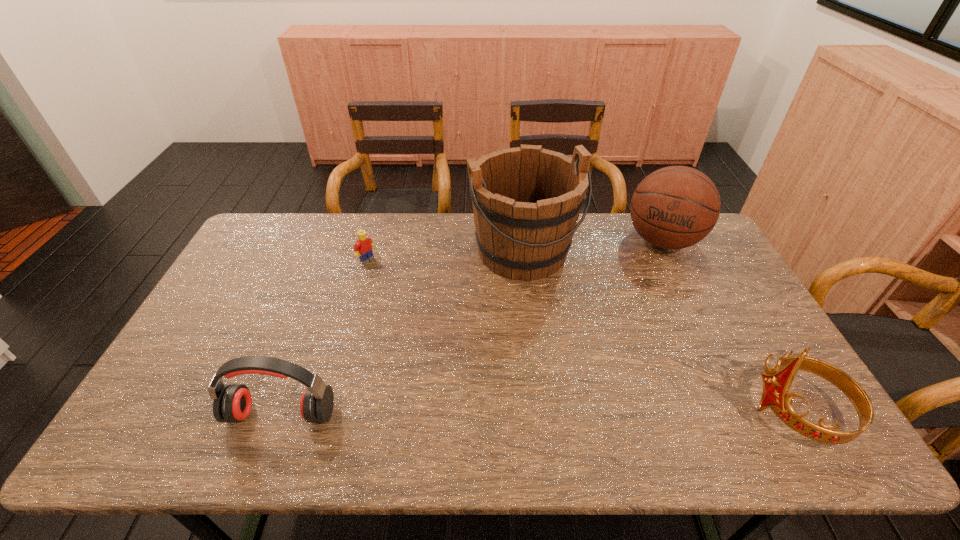
This screenshot has width=960, height=540. In order to click on vacant space situated on the front-facing side of the Lego in this screenshot , I will do `click(446, 318)`.

I want to click on vacant region located 0.390m on the front-facing side of the Lego, so tap(456, 325).

The image size is (960, 540). In order to click on vacant region located 0.310m on the side of the third object from right to left with the handle for carrying in this screenshot , I will do `click(585, 365)`.

I want to click on free spot located on the side of the third object from right to left with the handle for carrying, so click(x=584, y=362).

You are a GUI agent. You are given a task and a screenshot of the screen. Output one action in this format:
    pyautogui.click(x=<x>, y=<y>)
    Task: Click on the free spot located 0.240m on the side of the third object from right to left with the handle for carrying
    The image size is (960, 540).
    Given the screenshot: What is the action you would take?
    pyautogui.click(x=574, y=345)

Where is `free region located 0.220m on the side with brand label of the basketball`? free region located 0.220m on the side with brand label of the basketball is located at coordinates (641, 306).

The image size is (960, 540). Identify the location of vacant space situated 0.130m on the side with brand label of the basketball. (647, 287).

Where is `vacant space located on the side with brand label of the basketball`? vacant space located on the side with brand label of the basketball is located at coordinates (645, 293).

In order to click on Lego that is at the far edge in this screenshot , I will do [363, 247].

This screenshot has height=540, width=960. I want to click on wine bucket that is positioned at the far edge, so click(526, 200).